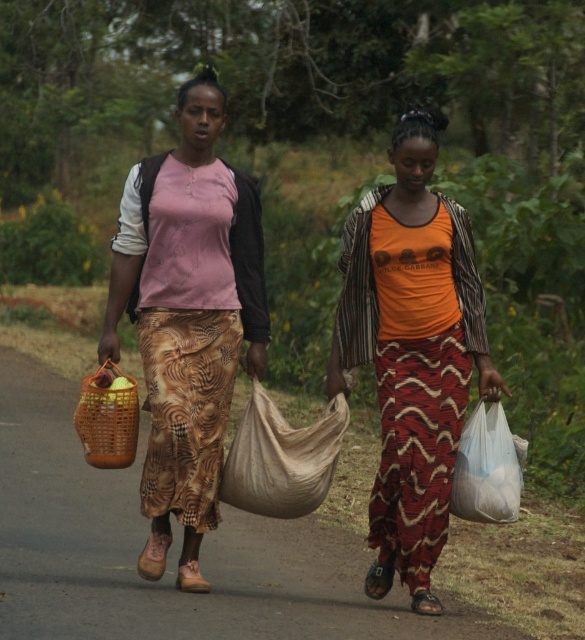
Can you confirm if woven basket at center is shorter than beige fabric sack at center?

Yes.

Measure the distance from woven basket at center to beige fabric sack at center.

woven basket at center is 23.82 inches away from beige fabric sack at center.

At what (x,y) coordinates should I click in order to perform the action: click on woven basket at center. Please return your answer as a coordinate pair (x, y). This screenshot has height=640, width=585. Looking at the image, I should click on (170, 550).

Between orange printed shirt at center and beige fabric sack at center, which one appears on the right side from the viewer's perspective?

orange printed shirt at center

At what (x,y) coordinates should I click in order to perform the action: click on orange printed shirt at center. Please return your answer as a coordinate pair (x, y). The height and width of the screenshot is (640, 585). Looking at the image, I should click on 411,352.

Can you confirm if woven basket at center is bigger than matte brown woven basket at left?

No.

Is woven basket at center below matte brown woven basket at left?

Yes.

Does point (91, 529) come behind point (183, 163)?

Yes, it is.

I want to click on woven basket at center, so click(170, 550).